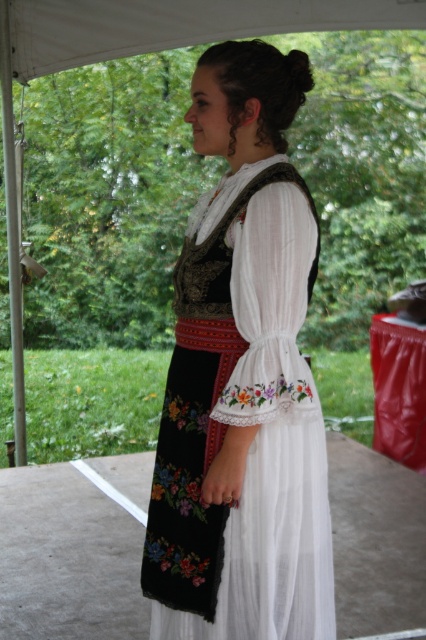
Question: Which point is farther to the camera?

Choices:
 (A) (109, 10)
 (B) (299, 470)

Answer: (A)

Question: Which point is farther from the camera taking this photo?

Choices:
 (A) (227, 484)
 (B) (123, 35)

Answer: (B)

Question: Is white embroidered dress at center positioned behind white fabric canopy at upper center?

Choices:
 (A) no
 (B) yes

Answer: (A)

Question: Observing the image, what is the correct spatial positioning of white embroidered dress at center in reference to white fabric canopy at upper center?

Choices:
 (A) above
 (B) below

Answer: (B)

Question: Where is white embroidered dress at center located in relation to white fabric canopy at upper center in the image?

Choices:
 (A) above
 (B) below

Answer: (B)